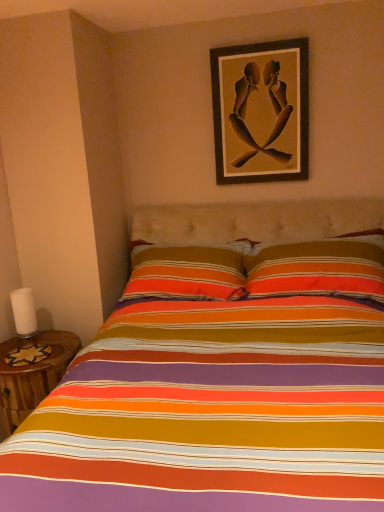
Question: Considering the relative sizes of wooden picture frame at upper center and white matte candle at left in the image provided, is wooden picture frame at upper center wider than white matte candle at left?

Choices:
 (A) yes
 (B) no

Answer: (B)

Question: Does wooden picture frame at upper center have a lesser height compared to white matte candle at left?

Choices:
 (A) yes
 (B) no

Answer: (B)

Question: From a real-world perspective, is wooden picture frame at upper center under white matte candle at left?

Choices:
 (A) no
 (B) yes

Answer: (A)

Question: Is wooden picture frame at upper center completely or partially outside of white matte candle at left?

Choices:
 (A) yes
 (B) no

Answer: (A)

Question: Does wooden picture frame at upper center have a greater height compared to white matte candle at left?

Choices:
 (A) yes
 (B) no

Answer: (A)

Question: Considering the positions of wooden picture frame at upper center and white matte candle at left in the image, is wooden picture frame at upper center bigger or smaller than white matte candle at left?

Choices:
 (A) small
 (B) big

Answer: (B)

Question: Is point (271, 179) positioned closer to the camera than point (14, 317)?

Choices:
 (A) farther
 (B) closer

Answer: (A)

Question: In the image, is wooden picture frame at upper center on the left side or the right side of white matte candle at left?

Choices:
 (A) left
 (B) right

Answer: (B)

Question: From the image's perspective, is wooden picture frame at upper center located above or below white matte candle at left?

Choices:
 (A) above
 (B) below

Answer: (A)

Question: From a real-world perspective, relative to wooden table at lower left, is white matte candle at left vertically above or below?

Choices:
 (A) above
 (B) below

Answer: (A)

Question: Is white matte candle at left taller or shorter than wooden table at lower left?

Choices:
 (A) short
 (B) tall

Answer: (A)

Question: Relative to wooden table at lower left, is white matte candle at left in front or behind?

Choices:
 (A) behind
 (B) front

Answer: (A)

Question: Choose the correct answer: Is white matte candle at left inside wooden table at lower left or outside it?

Choices:
 (A) outside
 (B) inside

Answer: (A)

Question: From a real-world perspective, is wooden table at lower left positioned above or below white matte candle at left?

Choices:
 (A) below
 (B) above

Answer: (A)

Question: Based on their sizes in the image, would you say wooden table at lower left is bigger or smaller than white matte candle at left?

Choices:
 (A) small
 (B) big

Answer: (B)